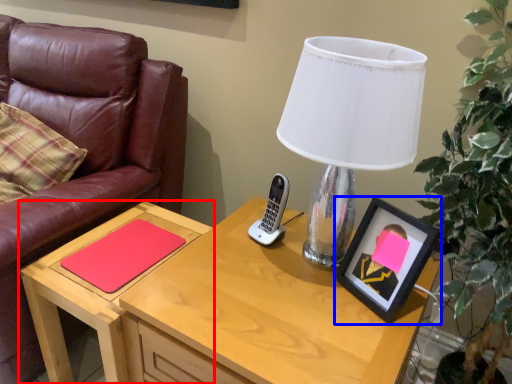
Question: Which of the following is the farthest to the observer, table (highlighted by a red box) or picture frame (highlighted by a blue box)?

Choices:
 (A) table
 (B) picture frame

Answer: (A)